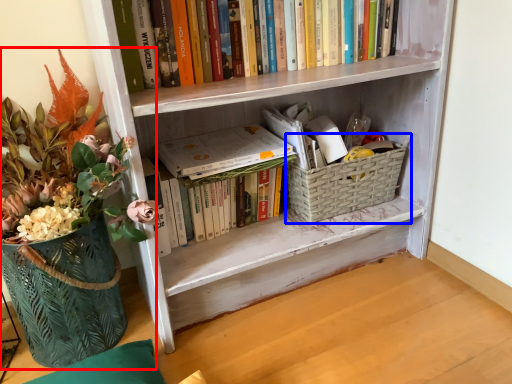
Question: Which object is closer to the camera taking this photo, houseplant (highlighted by a red box) or basket container (highlighted by a blue box)?

Choices:
 (A) houseplant
 (B) basket container

Answer: (A)